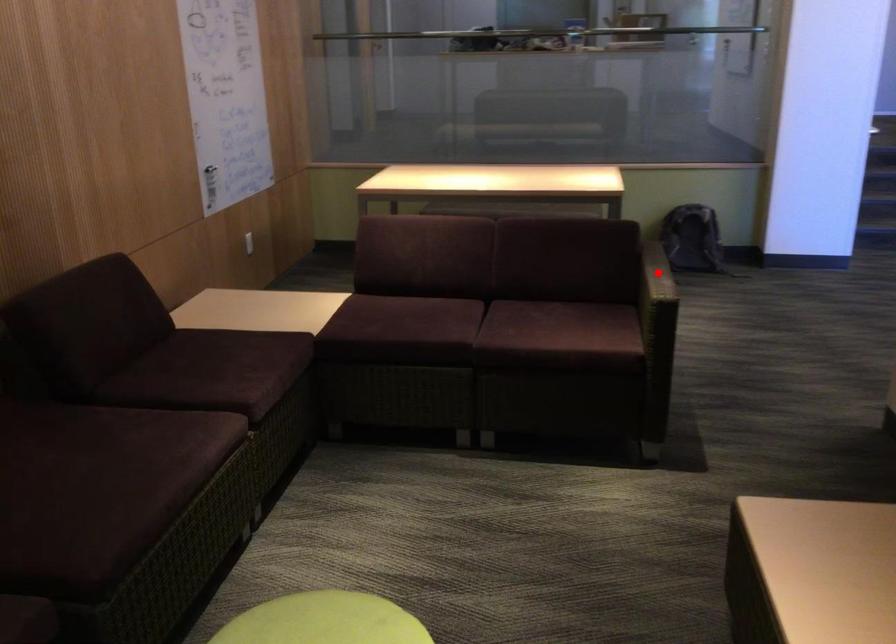
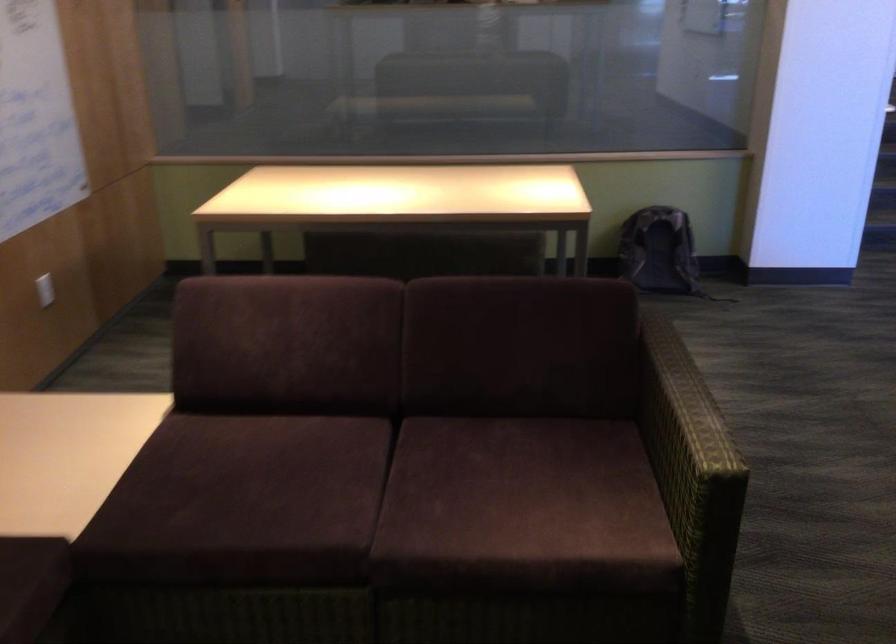
Find the pixel in the second image that matches the highlighted location in the first image.

(682, 404)